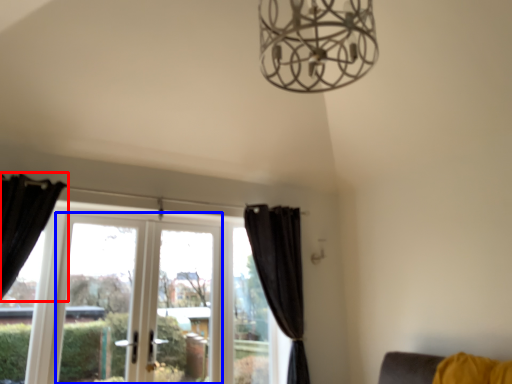
Question: Which object is closer to the camera taking this photo, curtain (highlighted by a red box) or screen door (highlighted by a blue box)?

Choices:
 (A) curtain
 (B) screen door

Answer: (A)